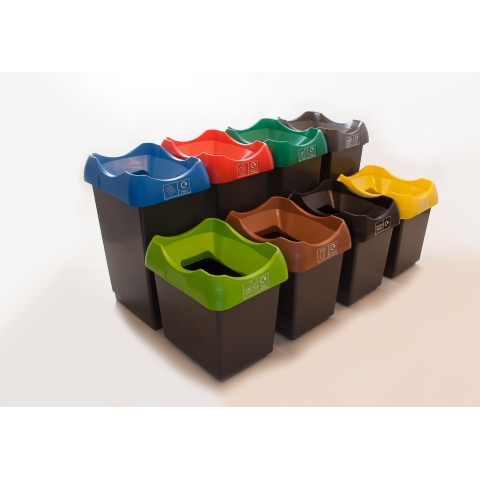
You are a GUI agent. You are given a task and a screenshot of the screen. Output one action in this format:
    pyautogui.click(x=<x>, y=<y>)
    Task: Click on the recycling bin
    The height and width of the screenshot is (480, 480).
    Given the screenshot: What is the action you would take?
    pyautogui.click(x=175, y=215), pyautogui.click(x=249, y=194), pyautogui.click(x=310, y=176), pyautogui.click(x=344, y=158), pyautogui.click(x=412, y=253), pyautogui.click(x=370, y=264), pyautogui.click(x=323, y=286), pyautogui.click(x=243, y=323)